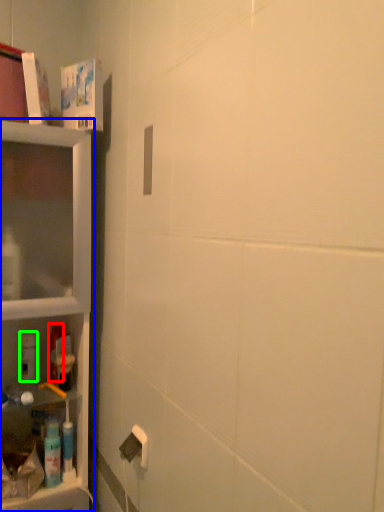
Question: Which object is the closest to the mouthwash (highlighted by a red box)? Choose among these: shelf (highlighted by a blue box) or cleaning product (highlighted by a green box).

Choices:
 (A) shelf
 (B) cleaning product

Answer: (B)